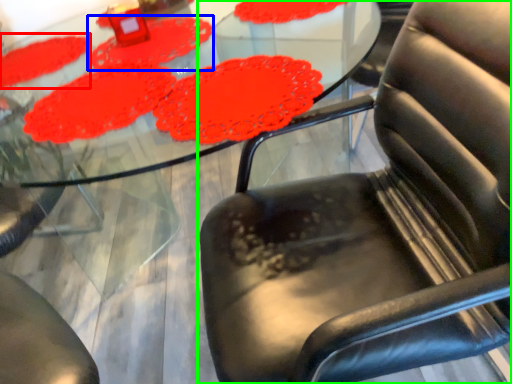
Question: Which object is positioned farthest from mat (highlighted by a red box)? Select from mat (highlighted by a blue box) and chair (highlighted by a green box).

Choices:
 (A) mat
 (B) chair

Answer: (B)